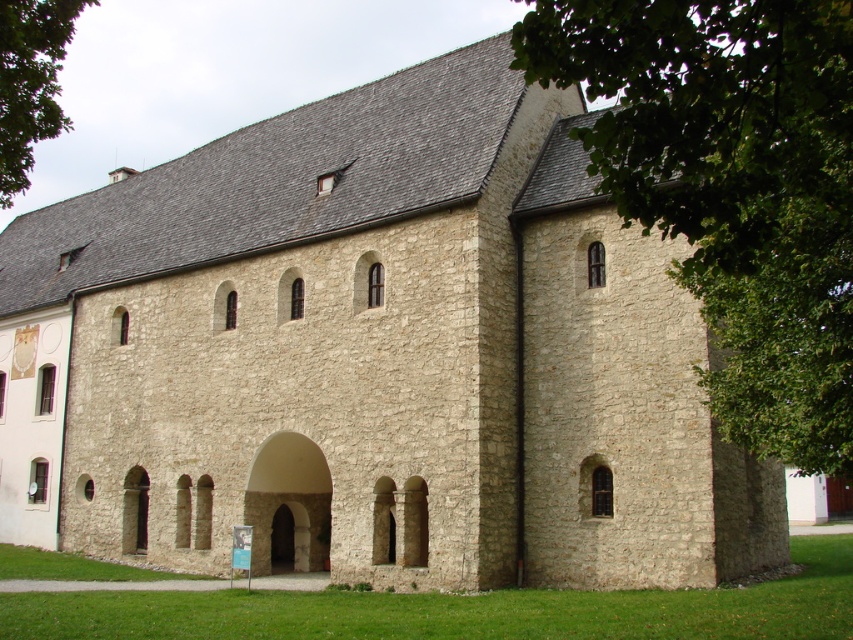
Can you confirm if green leafy tree at upper right is shorter than green leafy tree at upper left?

Yes.

Is point (811, 346) closer to viewer compared to point (61, 35)?

That is True.

Identify the location of green leafy tree at upper right. The width and height of the screenshot is (853, 640). (732, 188).

Between point (10, 198) and point (318, 477), which one is positioned in front?

Point (318, 477)

Who is more forward, (x=6, y=28) or (x=291, y=483)?

Point (x=6, y=28)

What are the coordinates of `green leafy tree at upper left` in the screenshot? It's located at click(30, 81).

Looking at this image, which of these two, green leafy tree at upper right or stone archway at center, stands shorter?

stone archway at center is shorter.

Who is higher up, green leafy tree at upper right or stone archway at center?

green leafy tree at upper right is higher up.

Between point (675, 268) and point (270, 531), which one is positioned behind?

Positioned behind is point (270, 531).

Identify the location of green leafy tree at upper right. This screenshot has height=640, width=853. (732, 188).